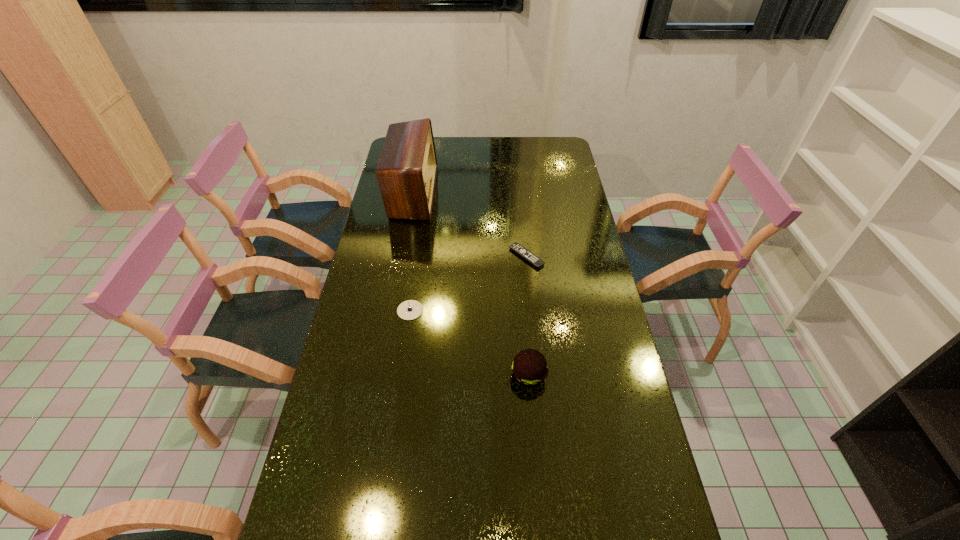
You are a GUI agent. You are given a task and a screenshot of the screen. Output one action in this format:
    pyautogui.click(x=<x>, y=<y>)
    Task: Click on the vacant area between the nearest object and the tallest object
    This screenshot has height=540, width=960.
    Given the screenshot: What is the action you would take?
    pyautogui.click(x=470, y=284)

This screenshot has height=540, width=960. I want to click on free space between the third shortest object and the shortest object, so click(527, 316).

Image resolution: width=960 pixels, height=540 pixels. Find the location of `vacant space that is in between the remote control and the second shortest object`. vacant space that is in between the remote control and the second shortest object is located at coordinates (468, 284).

Locate an element on the screen. The height and width of the screenshot is (540, 960). free area in between the compass and the remote control is located at coordinates (468, 284).

Select which object appears as the closest to the nearest object. Please provide its 2D coordinates. Your answer should be formatted as a tuple, i.e. [(x, y)], where the tuple contains the x and y coordinates of a point satisfying the conditions above.

[(408, 310)]

Identify the location of object that ranks as the second closest to the patty. (520, 250).

This screenshot has height=540, width=960. I want to click on vacant point that satisfies the following two spatial constraints: 1. on the front-facing side of the second farthest object; 2. on the right side of the farthest object, so click(x=401, y=256).

Where is `free space that satisfies the following two spatial constraints: 1. on the front-facing side of the second shortest object; 2. on the left side of the tallest object`? The height and width of the screenshot is (540, 960). free space that satisfies the following two spatial constraints: 1. on the front-facing side of the second shortest object; 2. on the left side of the tallest object is located at coordinates (392, 310).

Where is `blank area in the image that satisfies the following two spatial constraints: 1. on the back side of the patty; 2. on the front-facing side of the farthest object`? blank area in the image that satisfies the following two spatial constraints: 1. on the back side of the patty; 2. on the front-facing side of the farthest object is located at coordinates (513, 193).

Locate an element on the screen. free space that satisfies the following two spatial constraints: 1. on the front-facing side of the farthest object; 2. on the left side of the third farthest object is located at coordinates (392, 310).